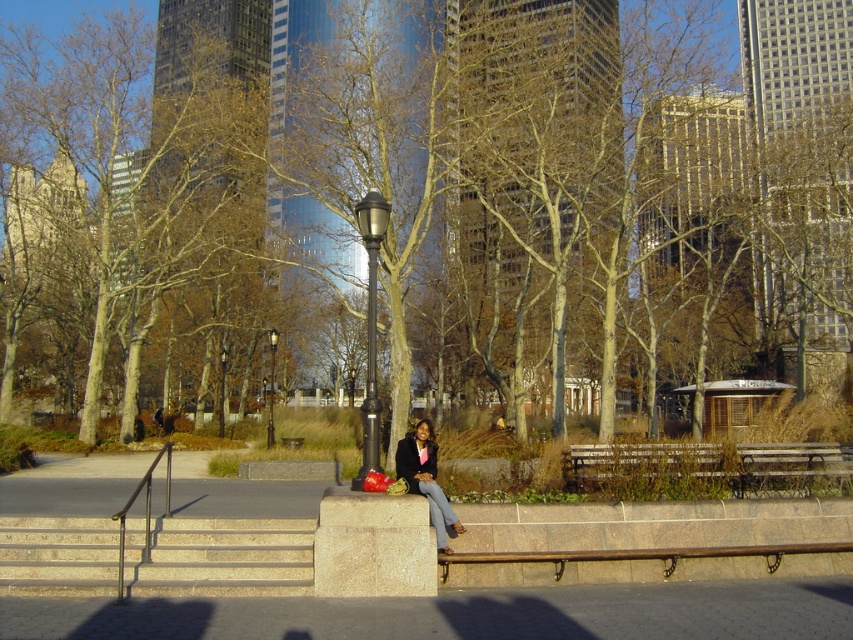
Where is `brown bark tree at center`? brown bark tree at center is located at coordinates (434, 193).

Does brown bark tree at center appear on the left side of matte black jacket at center?

In fact, brown bark tree at center is to the right of matte black jacket at center.

What are the coordinates of `brown bark tree at center` in the screenshot? It's located at (434, 193).

The width and height of the screenshot is (853, 640). What are the coordinates of `brown bark tree at center` in the screenshot? It's located at (434, 193).

Is brown bark tree at center taller than beige stone stairs at lower left?

Correct, brown bark tree at center is much taller as beige stone stairs at lower left.

Is the position of brown bark tree at center less distant than that of beige stone stairs at lower left?

That is False.

What do you see at coordinates (434, 193) in the screenshot? The image size is (853, 640). I see `brown bark tree at center` at bounding box center [434, 193].

The width and height of the screenshot is (853, 640). Find the location of `brown bark tree at center`. brown bark tree at center is located at coordinates (434, 193).

Based on the photo, does beige stone stairs at lower left have a lesser height compared to matte black jacket at center?

Yes.

The width and height of the screenshot is (853, 640). Find the location of `beige stone stairs at lower left`. beige stone stairs at lower left is located at coordinates click(221, 557).

Who is more forward, (225,532) or (431,490)?

Point (431,490) is more forward.

Where is `beige stone stairs at lower left`? The height and width of the screenshot is (640, 853). beige stone stairs at lower left is located at coordinates (221, 557).